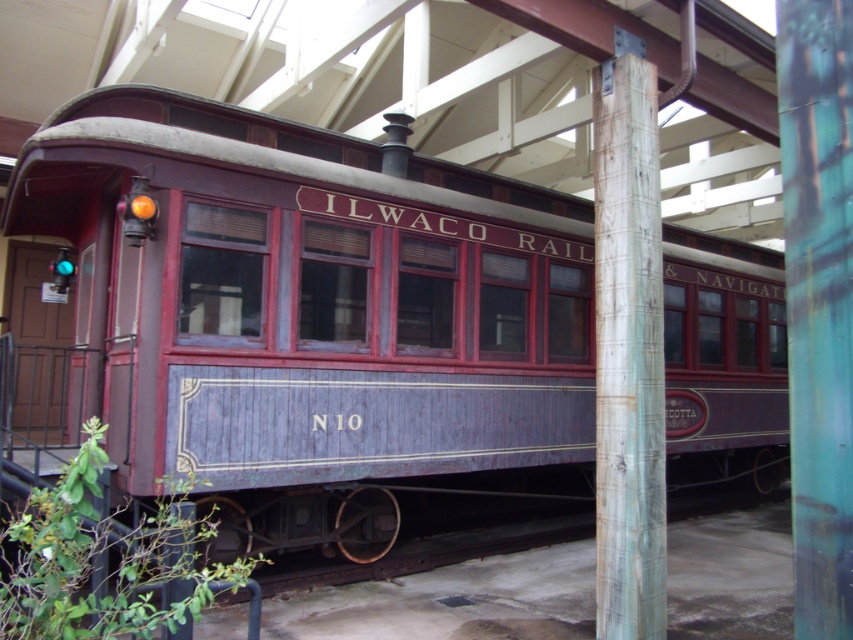
Between matte wood train car at center and wooden post at center, which one has more height?

wooden post at center is taller.

Does matte wood train car at center have a lesser width compared to wooden post at center?

Indeed, matte wood train car at center has a lesser width compared to wooden post at center.

Describe the element at coordinates (311, 310) in the screenshot. This screenshot has height=640, width=853. I see `matte wood train car at center` at that location.

Find the location of a particular element. The width and height of the screenshot is (853, 640). matte wood train car at center is located at coordinates (311, 310).